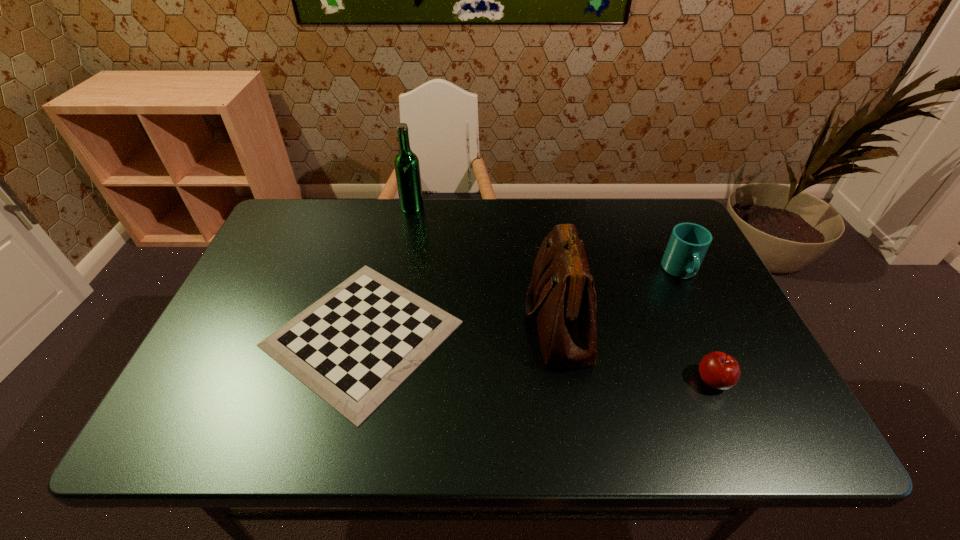
The image size is (960, 540). In order to click on object present at the far edge in this screenshot , I will do `click(406, 163)`.

Locate an element on the screen. The width and height of the screenshot is (960, 540). object located at the near edge is located at coordinates (353, 347).

Image resolution: width=960 pixels, height=540 pixels. Find the location of `object located in the left edge section of the desktop`. object located in the left edge section of the desktop is located at coordinates (353, 347).

This screenshot has height=540, width=960. Identify the location of cup that is positioned at the right edge. (688, 244).

Where is `apple at the right edge`? apple at the right edge is located at coordinates (720, 371).

Find the location of a particular element. The image size is (960, 540). object present at the near left corner is located at coordinates (353, 347).

Locate an element on the screen. This screenshot has width=960, height=540. vacant space at the far edge is located at coordinates (347, 221).

Locate an element on the screen. vacant region at the left edge of the desktop is located at coordinates click(x=248, y=343).

Find the location of `free space at the far left corner of the desktop`. free space at the far left corner of the desktop is located at coordinates (314, 199).

Locate an element on the screen. free spot at the near right corner of the desktop is located at coordinates (790, 436).